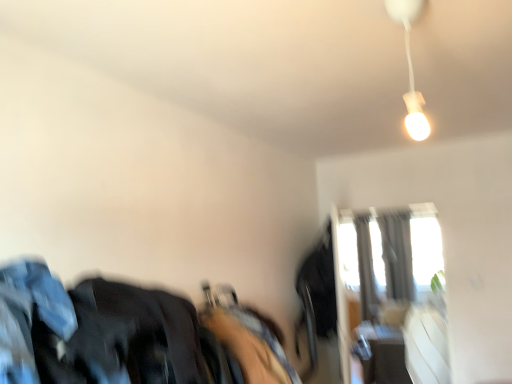
Question: Is white matte lamp at upper right behind transparent glass window at upper right?

Choices:
 (A) yes
 (B) no

Answer: (B)

Question: From a real-world perspective, does white matte lamp at upper right stand above transparent glass window at upper right?

Choices:
 (A) yes
 (B) no

Answer: (A)

Question: Is white matte lamp at upper right at the left side of transparent glass window at upper right?

Choices:
 (A) no
 (B) yes

Answer: (B)

Question: From a real-world perspective, is white matte lamp at upper right below transparent glass window at upper right?

Choices:
 (A) no
 (B) yes

Answer: (A)

Question: Is white matte lamp at upper right not inside transparent glass window at upper right?

Choices:
 (A) yes
 (B) no

Answer: (A)

Question: Does white matte lamp at upper right come in front of transparent glass window at upper right?

Choices:
 (A) no
 (B) yes

Answer: (B)

Question: Is dark blue fabric at left directly adjacent to transparent glass window at upper right?

Choices:
 (A) no
 (B) yes

Answer: (A)

Question: Does dark blue fabric at left lie behind transparent glass window at upper right?

Choices:
 (A) yes
 (B) no

Answer: (B)

Question: Considering the relative positions of dark blue fabric at left and transparent glass window at upper right in the image provided, is dark blue fabric at left to the right of transparent glass window at upper right from the viewer's perspective?

Choices:
 (A) no
 (B) yes

Answer: (A)

Question: Considering the relative sizes of dark blue fabric at left and transparent glass window at upper right in the image provided, is dark blue fabric at left bigger than transparent glass window at upper right?

Choices:
 (A) yes
 (B) no

Answer: (B)

Question: Would you say dark blue fabric at left is outside transparent glass window at upper right?

Choices:
 (A) no
 (B) yes

Answer: (B)

Question: Is dark blue fabric at left looking in the opposite direction of transparent glass window at upper right?

Choices:
 (A) no
 (B) yes

Answer: (A)

Question: Are dark blue fabric at left and silky gray curtain at upper right far apart?

Choices:
 (A) no
 (B) yes

Answer: (B)